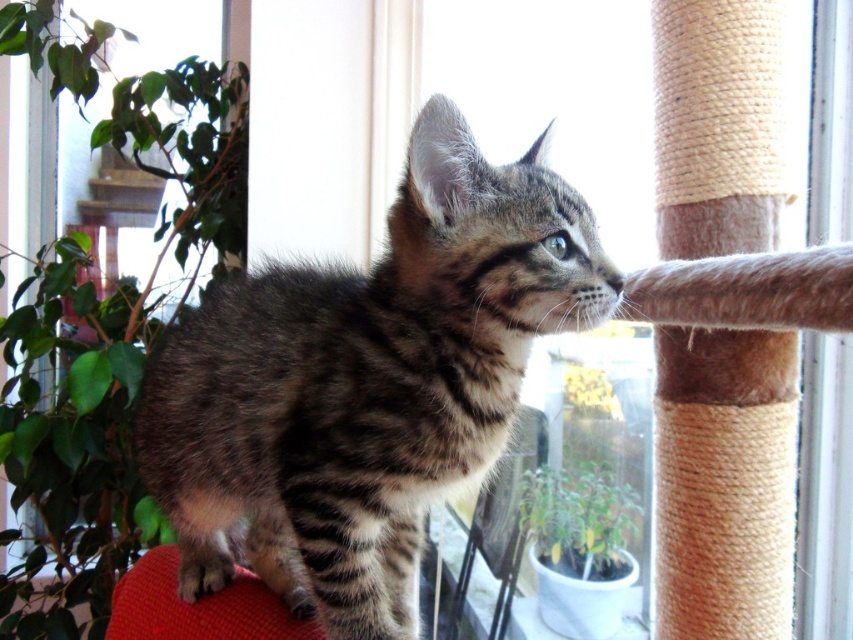
Question: Is striped fur cat at center positioned before green matte plant at lower center?

Choices:
 (A) no
 (B) yes

Answer: (B)

Question: Which object is farther from the camera taking this photo?

Choices:
 (A) green matte plant at lower center
 (B) striped fur cat at center

Answer: (A)

Question: Can you confirm if striped fur cat at center is positioned above green matte plant at lower center?

Choices:
 (A) yes
 (B) no

Answer: (A)

Question: In this image, where is striped fur cat at center located relative to green matte plant at lower center?

Choices:
 (A) above
 (B) below

Answer: (A)

Question: Which is nearer to the striped fur cat at center?

Choices:
 (A) green matte plant at lower center
 (B) green leafy plant at left

Answer: (A)

Question: Which is nearer to the striped fur cat at center?

Choices:
 (A) green leafy plant at left
 (B) green matte plant at lower center

Answer: (B)